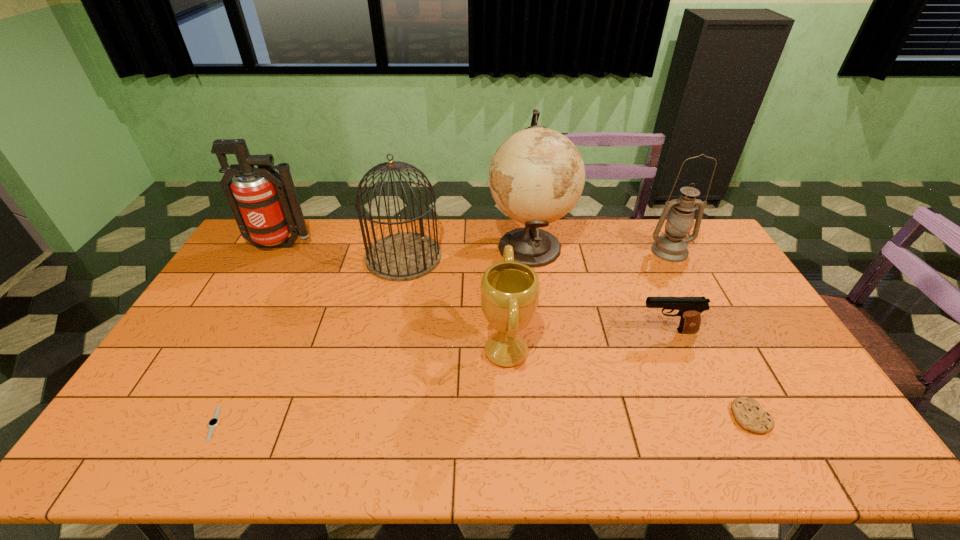
Find the location of a particular element. This screenshot has height=540, width=960. vacant area that lies between the fire extinguisher and the oil lamp is located at coordinates click(475, 248).

Identify the location of free space that is in between the oil lamp and the cookie. (710, 334).

You are a GUI agent. You are given a task and a screenshot of the screen. Output one action in this format:
    pyautogui.click(x=<x>, y=<y>)
    Task: Click on the vacant point located between the birdcage and the globe
    
    Given the screenshot: What is the action you would take?
    pyautogui.click(x=467, y=252)

At what (x,y) coordinates should I click in order to perform the action: click on free point between the birdcage and the second shortest object. Please return your answer as a coordinate pair (x, y). Looking at the image, I should click on (577, 337).

The image size is (960, 540). What are the coordinates of `vacant point located between the pistol and the shortest object` in the screenshot? It's located at point(441,377).

Identify the location of free area in between the fire extinguisher and the birdcage. (343, 251).

This screenshot has height=540, width=960. Identify the location of free space between the sixth object from right to left and the globe. (467, 252).

Where is `vacant space in between the globe and the sixth tallest object`? The width and height of the screenshot is (960, 540). vacant space in between the globe and the sixth tallest object is located at coordinates (598, 289).

I want to click on free space between the oil lamp and the watch, so click(442, 337).

I want to click on the seventh closest object relative to the watch, so click(x=672, y=246).